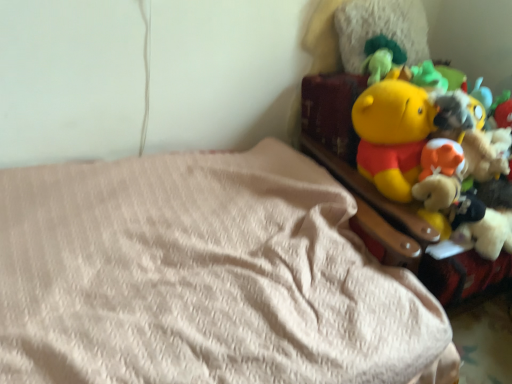
Question: Considering the relative positions of yellow plush toy at upper right and beige fabric bed at lower left in the image provided, is yellow plush toy at upper right to the left or to the right of beige fabric bed at lower left?

Choices:
 (A) right
 (B) left

Answer: (A)

Question: From a real-world perspective, is yellow plush toy at upper right positioned above or below beige fabric bed at lower left?

Choices:
 (A) below
 (B) above

Answer: (B)

Question: From their relative heights in the image, would you say yellow plush toy at upper right is taller or shorter than beige fabric bed at lower left?

Choices:
 (A) short
 (B) tall

Answer: (A)

Question: Looking at their shapes, would you say beige fabric bed at lower left is wider or thinner than yellow plush toy at upper right?

Choices:
 (A) thin
 (B) wide

Answer: (B)

Question: From the image's perspective, is beige fabric bed at lower left positioned above or below yellow plush toy at upper right?

Choices:
 (A) above
 (B) below

Answer: (B)

Question: Is beige fabric bed at lower left spatially inside yellow plush toy at upper right, or outside of it?

Choices:
 (A) inside
 (B) outside

Answer: (B)

Question: Relative to yellow plush toy at upper right, is beige fabric bed at lower left in front or behind?

Choices:
 (A) behind
 (B) front

Answer: (B)